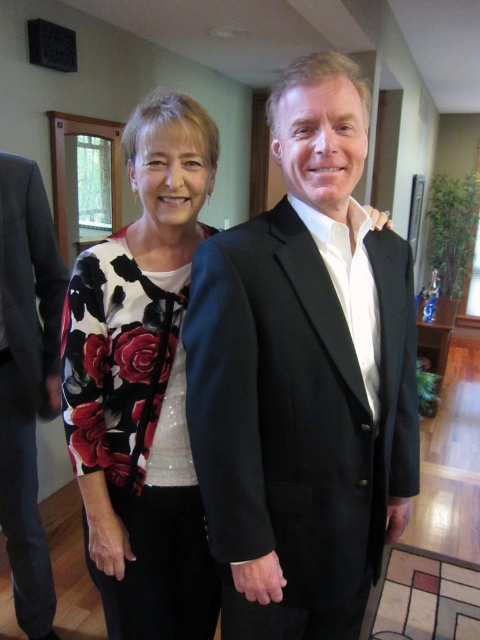
Question: Is floral-patterned blouse at center bigger than dark gray wool suit at left?

Choices:
 (A) no
 (B) yes

Answer: (B)

Question: Can you confirm if floral-patterned blouse at center is positioned above dark gray wool suit at left?

Choices:
 (A) no
 (B) yes

Answer: (B)

Question: Is the position of floral-patterned blouse at center less distant than that of dark gray wool suit at left?

Choices:
 (A) yes
 (B) no

Answer: (A)

Question: Which point is farther from the camera taking this photo?

Choices:
 (A) (133, 355)
 (B) (27, 164)

Answer: (B)

Question: Which of the following is the farthest from the observer?

Choices:
 (A) floral-patterned blouse at center
 (B) dark gray wool suit at left
 (C) black smooth suit at center

Answer: (B)

Question: Based on their relative distances, which object is farther from the dark gray wool suit at left?

Choices:
 (A) floral-patterned blouse at center
 (B) black smooth suit at center

Answer: (B)